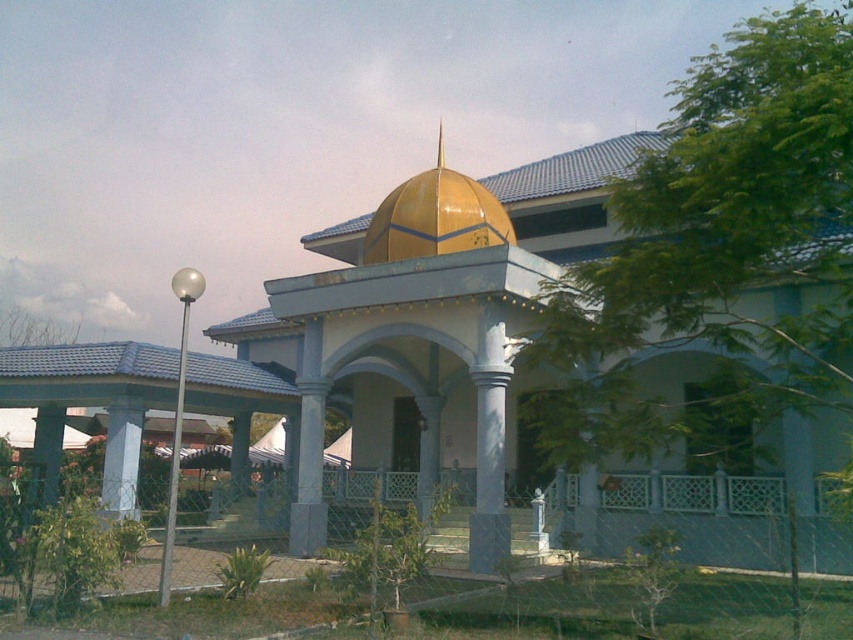
You are an architect designing a new mosque and want to ensure there is enough space between the white concrete pillar at center and the smooth concrete pillar at center for a 2 meter wide decorative arch. Based on the image, will the pillars be spaced far enough apart to accommodate the arch?

The white concrete pillar at center is 2.19 meters from the smooth concrete pillar at center, which is sufficient to accommodate a 2 meter wide decorative arch since the distance between them is greater than the required width.

You are standing in front of the mosque and want to take a photo of the smooth concrete column at center and the smooth concrete pillar at center. Which one should you focus on first if you want to capture both clearly in the same frame?

You should focus on the smooth concrete column at center first because it is closer to you than the smooth concrete pillar at center, ensuring both are in focus when using depth of field.

You are standing at the entrance of the mosque and want to take a photo of the gold shiny dome at center. If your camera can focus on objects up to 15 meters away, will it be able to capture the dome clearly?

The gold shiny dome at center is 15.36 meters away from the camera. Since the camera can focus up to 15 meters, it cannot capture the dome clearly as the distance exceeds its maximum focus range.